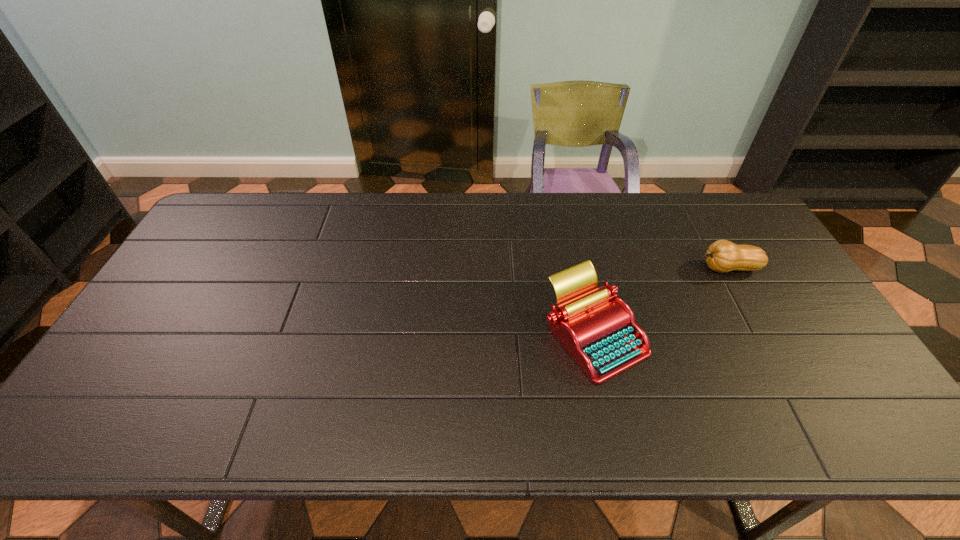
Locate an element on the screen. This screenshot has height=540, width=960. free space that satisfies the following two spatial constraints: 1. on the stem side of the farther object; 2. on the typing side of the taller object is located at coordinates (764, 335).

Locate an element on the screen. blank space that satisfies the following two spatial constraints: 1. on the stem side of the gourd; 2. on the typing side of the left object is located at coordinates (764, 335).

You are a GUI agent. You are given a task and a screenshot of the screen. Output one action in this format:
    pyautogui.click(x=<x>, y=<y>)
    Task: Click on the free space that satisfies the following two spatial constraints: 1. on the stem side of the farther object; 2. on the typing side of the typewriter
    This screenshot has width=960, height=540.
    Given the screenshot: What is the action you would take?
    pyautogui.click(x=764, y=335)

The width and height of the screenshot is (960, 540). I want to click on free space in the image that satisfies the following two spatial constraints: 1. on the stem side of the gourd; 2. on the typing side of the typewriter, so click(764, 335).

Locate an element on the screen. free space that satisfies the following two spatial constraints: 1. on the stem side of the shorter object; 2. on the typing side of the typewriter is located at coordinates (764, 335).

Find the location of a particular element. Image resolution: width=960 pixels, height=540 pixels. vacant space that satisfies the following two spatial constraints: 1. on the stem side of the gourd; 2. on the typing side of the left object is located at coordinates (764, 335).

Identify the location of vacant space that satisfies the following two spatial constraints: 1. on the stem side of the farther object; 2. on the typing side of the typewriter. (764, 335).